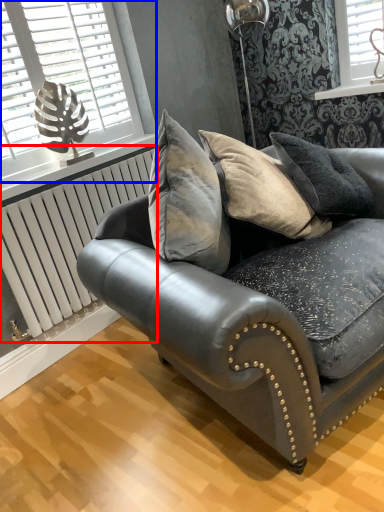
Question: Which of the following is the farthest to the observer, radiator (highlighted by a red box) or window (highlighted by a blue box)?

Choices:
 (A) radiator
 (B) window

Answer: (A)